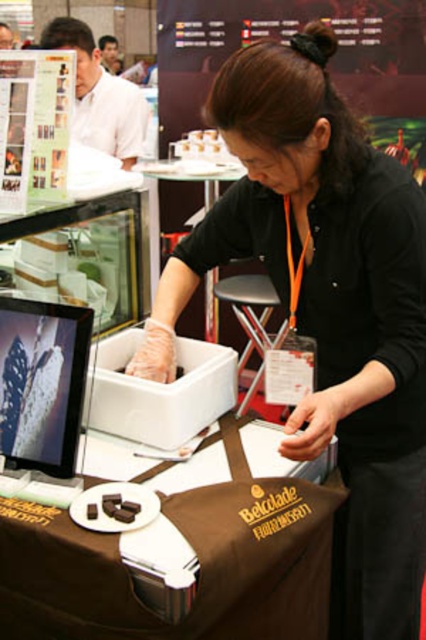
Question: Does brown fabric table at center appear on the right side of matte white shirt at upper left?

Choices:
 (A) yes
 (B) no

Answer: (A)

Question: Which point is closer to the camera?

Choices:
 (A) white plastic container at center
 (B) metallic silver stool at center
 (C) brown fabric table at center
 (D) black matte shirt at center

Answer: (C)

Question: Is black matte shirt at center further to the viewer compared to metallic silver stool at center?

Choices:
 (A) no
 (B) yes

Answer: (A)

Question: Which point is farther from the camera taking this photo?

Choices:
 (A) (16, 520)
 (B) (328, 324)
 (C) (66, 20)
 (D) (255, 332)

Answer: (D)

Question: Which point is farther to the camera?

Choices:
 (A) (305, 317)
 (B) (215, 234)
 (C) (80, 97)
 (D) (293, 608)

Answer: (C)

Question: Observing the image, what is the correct spatial positioning of black matte shirt at center in reference to white plastic container at center?

Choices:
 (A) below
 (B) above

Answer: (A)